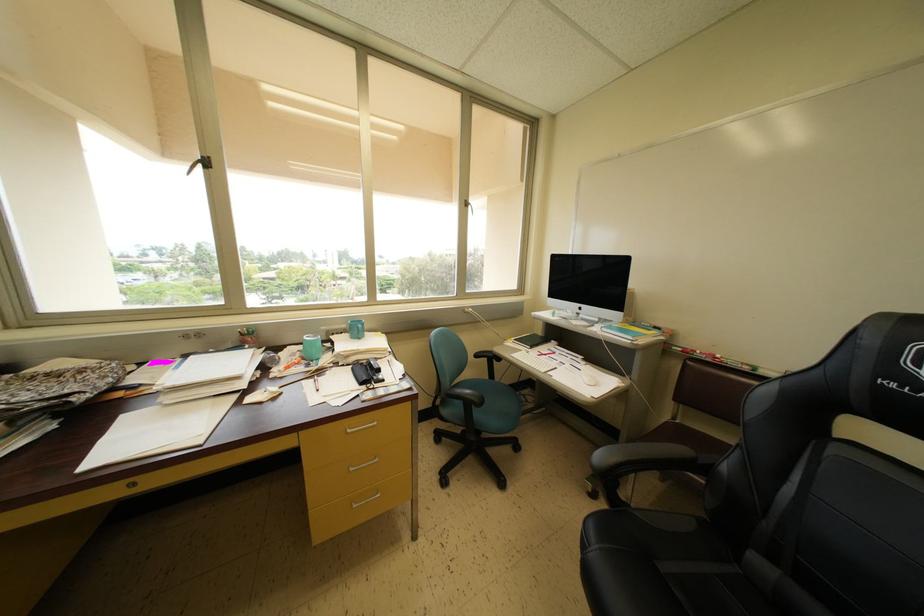
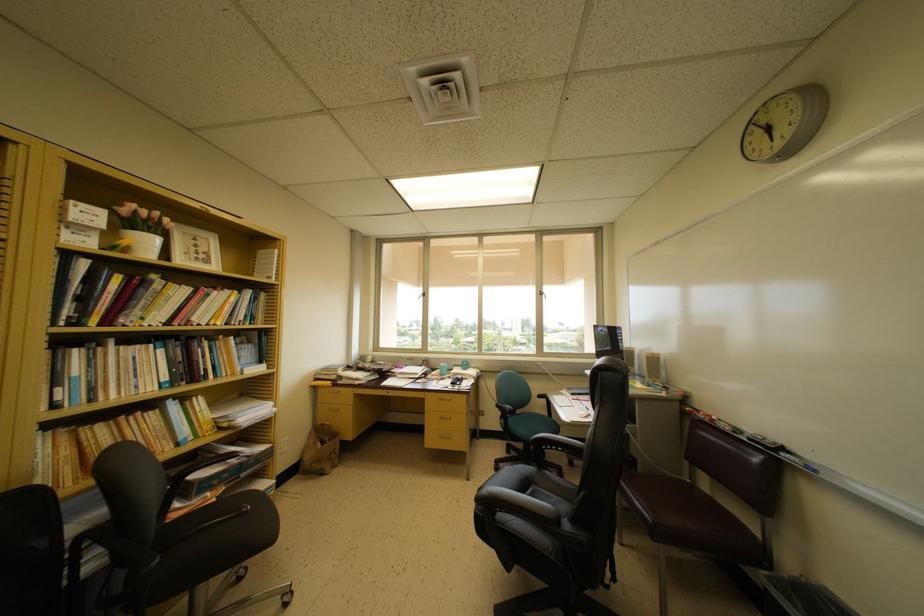
The point at (469, 206) is marked in the first image. Where is the corresponding point in the second image?

(543, 297)